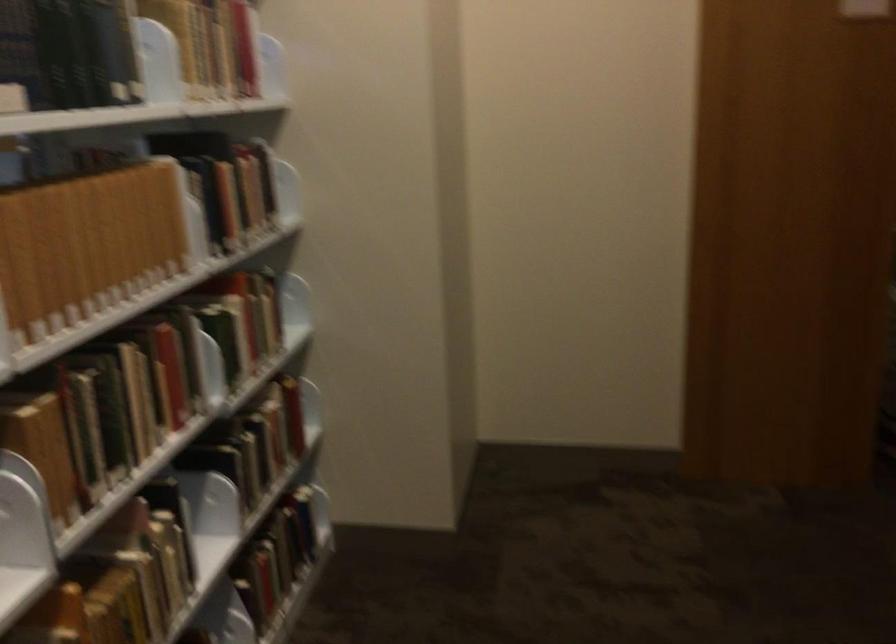
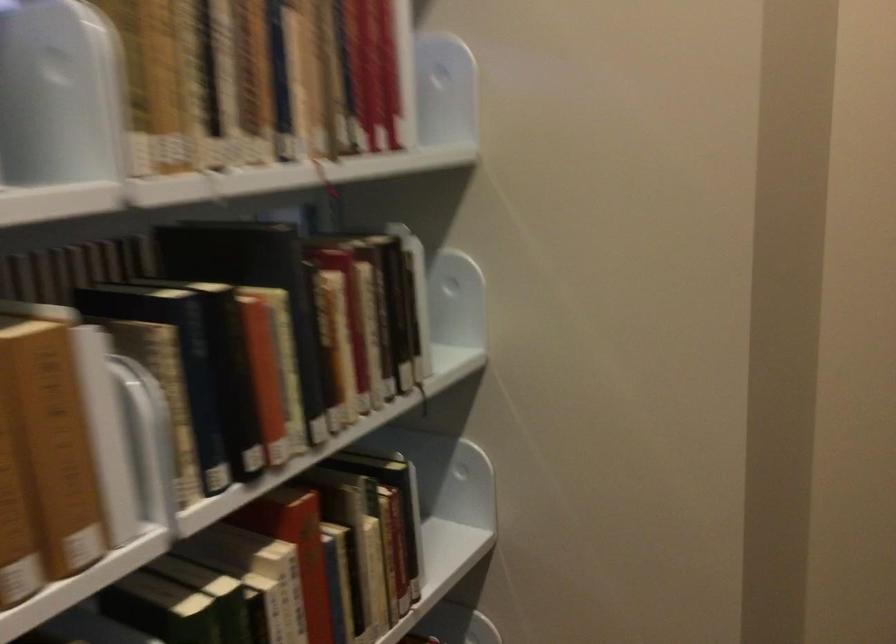
Locate, in the second image, the point that corresponds to [234,305] in the first image.

(289, 564)